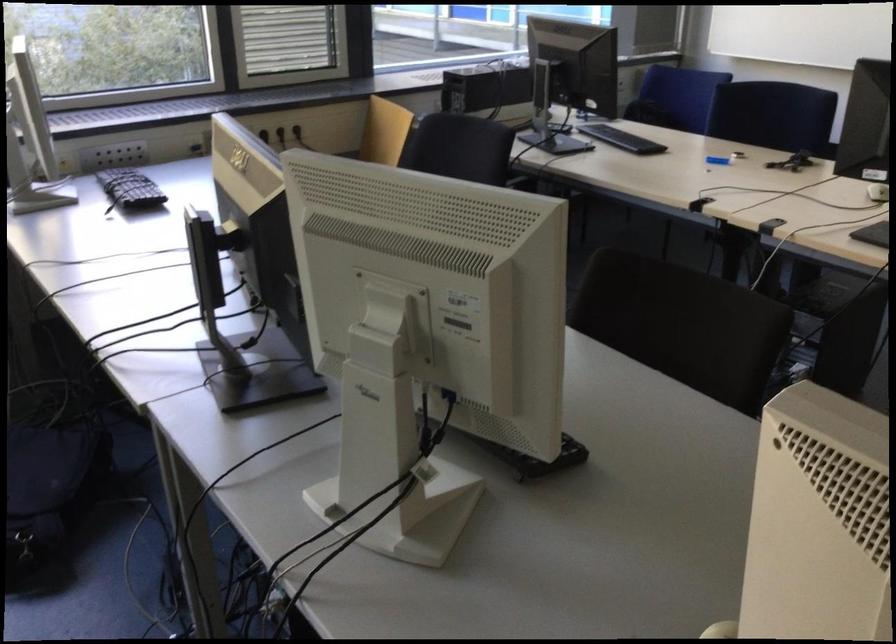
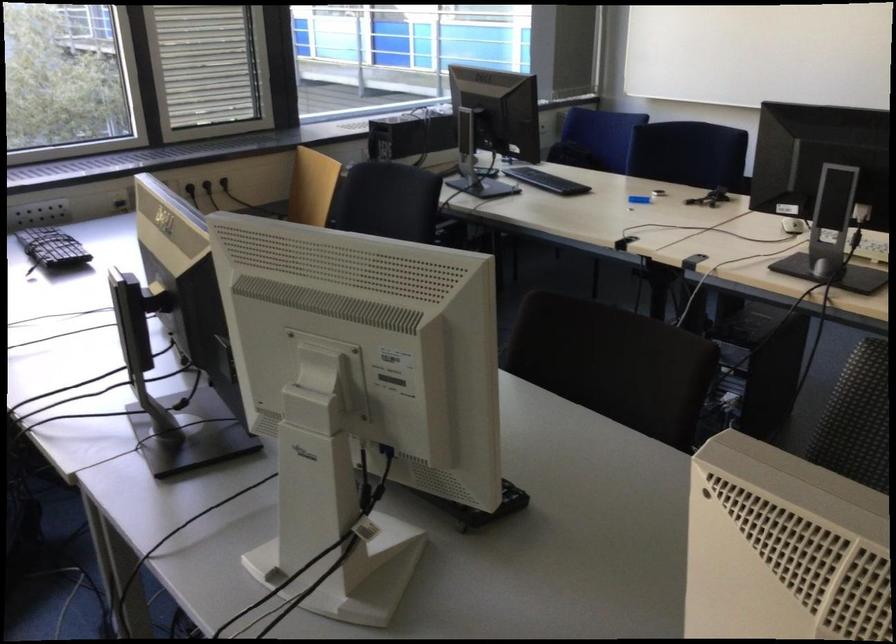
In the second image, find the point that corresponds to point (675, 98) in the first image.

(596, 138)